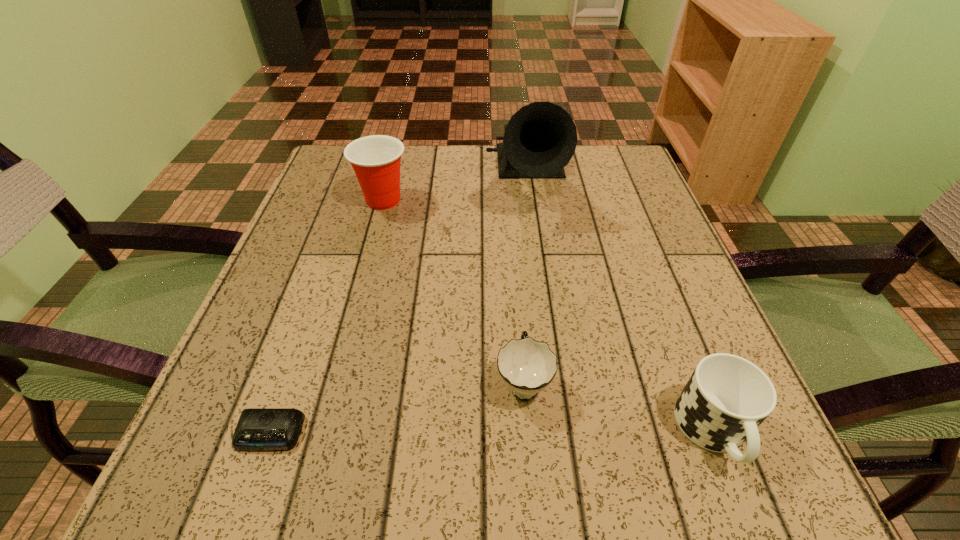
The height and width of the screenshot is (540, 960). Find the location of `the closest cup to the fourth shortest object`. the closest cup to the fourth shortest object is located at coordinates (526, 366).

This screenshot has width=960, height=540. I want to click on cup identified as the closest to the shortest cup, so point(727,397).